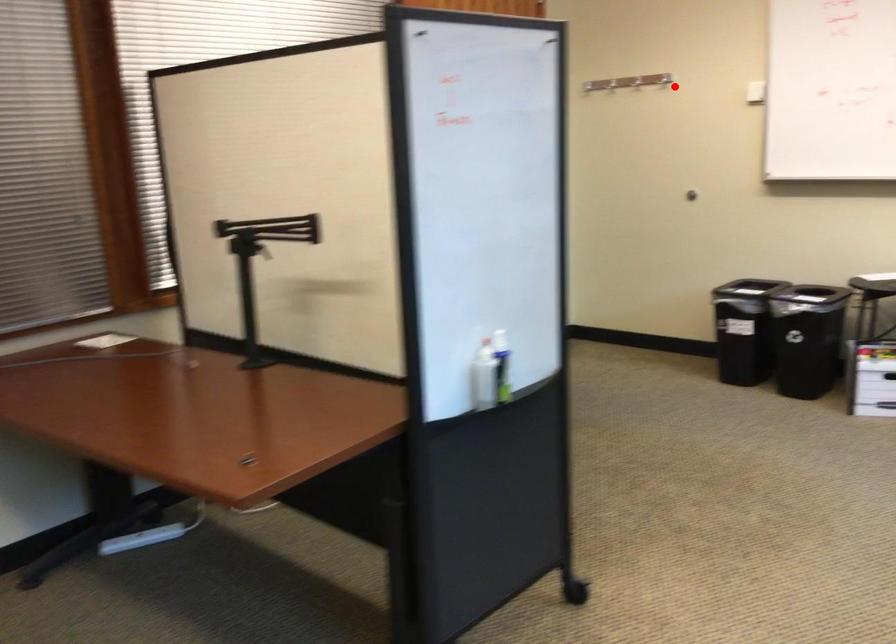
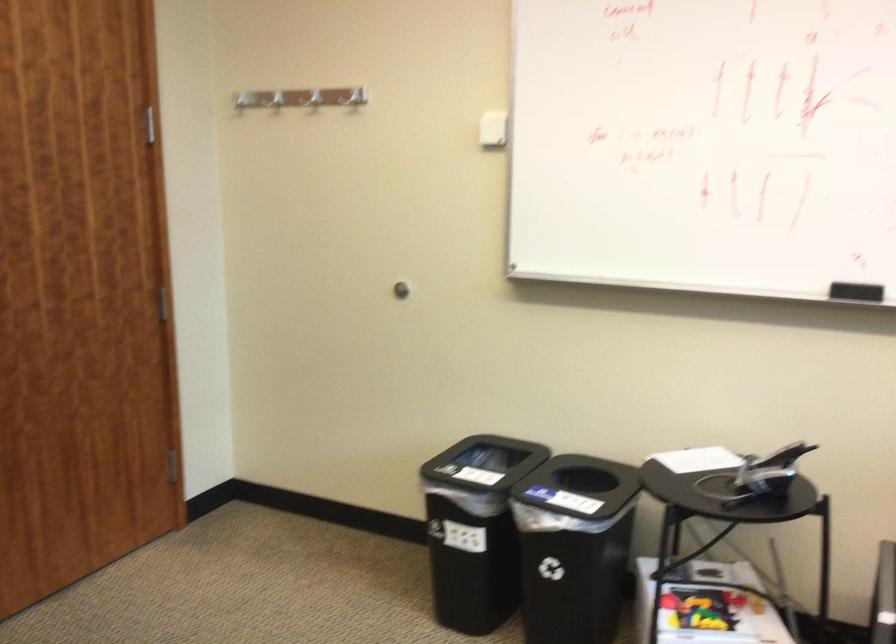
Question: I am providing you with two images of the same scene from different viewpoints. Given a red point in image1, look at the same physical point in image2. Is it:

Choices:
 (A) Closer to the viewpoint
 (B) Farther from the viewpoint

Answer: (A)